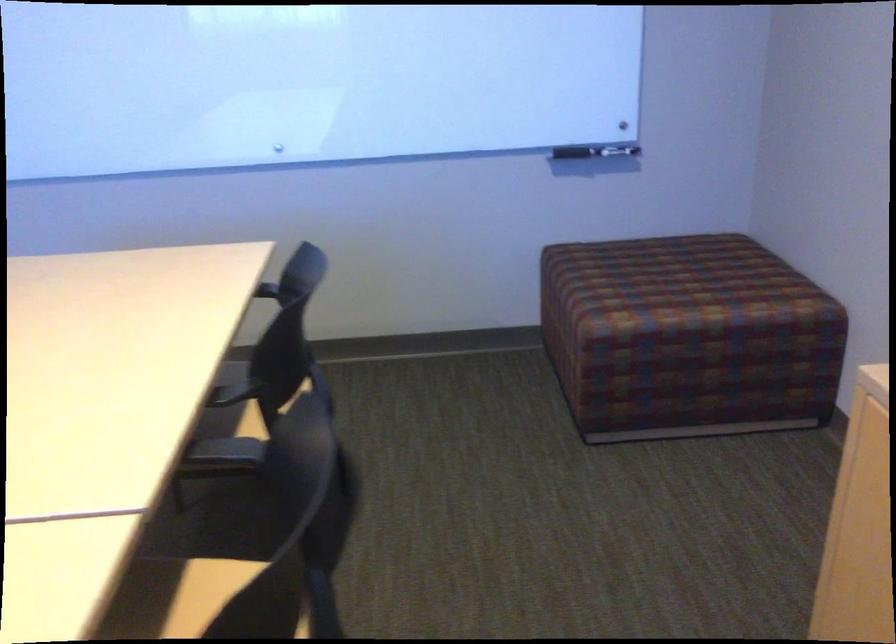
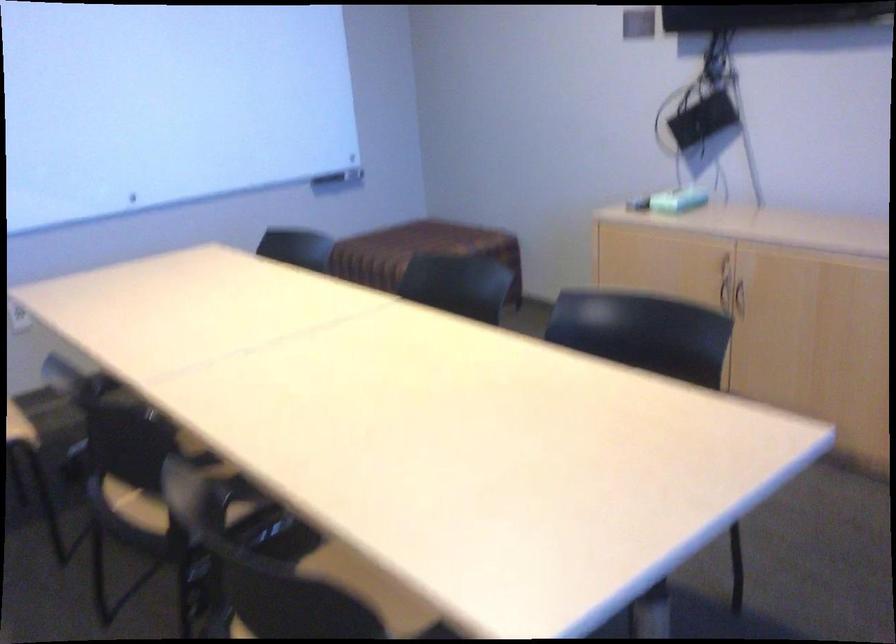
Locate, in the second image, the point that corresponds to point 590,160 in the first image.

(339, 178)